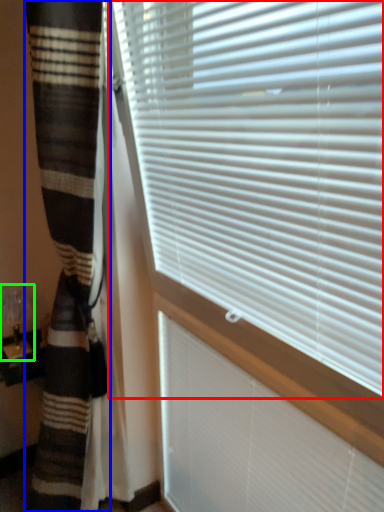
Question: Based on their relative distances, which object is nearer to window blind (highlighted by a red box)? Choose from curtain (highlighted by a blue box) and table lamp (highlighted by a green box).

Choices:
 (A) curtain
 (B) table lamp

Answer: (A)